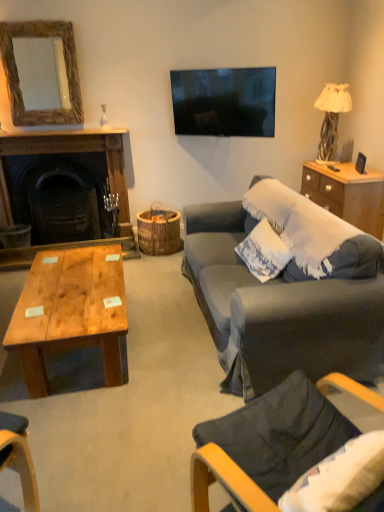
Identify the location of free spot below wooden frame mirror at upper left (from a real-world perspective). (48, 130).